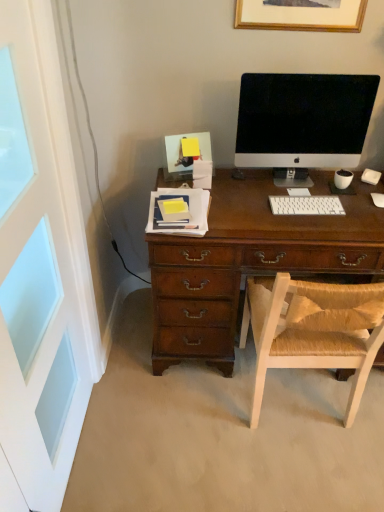
Identify the location of light brown woven chair at center. Image resolution: width=384 pixels, height=512 pixels. (313, 331).

Where is `satin black monitor at center`? The image size is (384, 512). satin black monitor at center is located at coordinates (303, 122).

In order to face white painted wood screen door at left, should I rotate leftwards or rightwards?

You should look left and rotate roughly 19.902 degrees.

Measure the distance between wooden picture frame at upper center and camera.

wooden picture frame at upper center is 1.61 meters away from camera.

Find the location of a particular element. The image size is (384, 512). wooden picture frame at upper center is located at coordinates (300, 15).

Where is `light brown woven chair at center`? The height and width of the screenshot is (512, 384). light brown woven chair at center is located at coordinates (313, 331).

Is wooden picture frame at upper center facing towards satin black monitor at center?

No, wooden picture frame at upper center is not turned towards satin black monitor at center.

From the image's perspective, which one is positioned lower, wooden picture frame at upper center or satin black monitor at center?

satin black monitor at center appears lower in the image.

From a real-world perspective, which object stands above the other?

wooden picture frame at upper center.

Does point (274, 304) appear closer or farther from the camera than point (373, 93)?

Point (274, 304) is closer to the camera than point (373, 93).

Is light brown woven chair at center not close to satin black monitor at center?

No, light brown woven chair at center is not far away from satin black monitor at center.

Is light brown woven chair at center positioned with its back to satin black monitor at center?

No, light brown woven chair at center is not facing the opposite direction of satin black monitor at center.

Based on the photo, can you confirm if light brown woven chair at center is positioned to the left of satin black monitor at center?

In fact, light brown woven chair at center is to the right of satin black monitor at center.

Would you say light brown woven chair at center is outside white painted wood screen door at left?

Yes, light brown woven chair at center is located beyond the bounds of white painted wood screen door at left.

From a real-world perspective, which is physically above, light brown woven chair at center or white painted wood screen door at left?

In real-world perspective, white painted wood screen door at left is above.

Which is behind, point (346, 342) or point (82, 264)?

The point (82, 264) is behind.

Between point (35, 33) and point (300, 330), which one is positioned behind?

The point (300, 330) is behind.

From a real-world perspective, which is physically above, white painted wood screen door at left or light brown woven chair at center?

In real-world perspective, white painted wood screen door at left is above.

This screenshot has height=512, width=384. In the image, there is a light brown woven chair at center. Find the location of `screen door above it (from the image's perspective)`. screen door above it (from the image's perspective) is located at coordinates (40, 268).

Can you confirm if white plastic keyboard at center is wider than light brown woven chair at center?

No.

In the scene shown: Would you say white plastic keyboard at center is a long distance from light brown woven chair at center?

No, white plastic keyboard at center is in close proximity to light brown woven chair at center.

How different are the orientations of white plastic keyboard at center and light brown woven chair at center in degrees?

The angle between the facing direction of white plastic keyboard at center and the facing direction of light brown woven chair at center is 180 degrees.

Considering the positions of points (314, 209) and (305, 310), is point (314, 209) farther from camera compared to point (305, 310)?

That is True.

From the image's perspective, who appears lower, satin black monitor at center or white painted wood screen door at left?

white painted wood screen door at left is shown below in the image.

From a real-world perspective, relative to white painted wood screen door at left, is satin black monitor at center vertically above or below?

In terms of real-world spatial position, satin black monitor at center is above white painted wood screen door at left.

Can you confirm if satin black monitor at center is smaller than white painted wood screen door at left?

Correct, satin black monitor at center occupies less space than white painted wood screen door at left.

From the image's perspective, who appears lower, white plastic keyboard at center or wooden picture frame at upper center?

white plastic keyboard at center.

Which of these two, white plastic keyboard at center or wooden picture frame at upper center, stands taller?

With more height is wooden picture frame at upper center.

Which object is further away from the camera taking this photo, white plastic keyboard at center or wooden picture frame at upper center?

white plastic keyboard at center is more distant.

At what (x,y) coordinates should I click in order to perform the action: click on picture frame located above the white plastic keyboard at center (from the image's perspective). Please return your answer as a coordinate pair (x, y). Image resolution: width=384 pixels, height=512 pixels. Looking at the image, I should click on (300, 15).

Identify the location of picture frame on the left of satin black monitor at center. This screenshot has height=512, width=384. (300, 15).

Identify the location of chair that is in front of the satin black monitor at center. (313, 331).

Considering their positions, is light brown woven chair at center positioned closer to wooden picture frame at upper center than satin black monitor at center?

satin black monitor at center lies closer to wooden picture frame at upper center than the other object.

In the scene shown: Considering their positions, is white painted wood screen door at left positioned closer to wooden picture frame at upper center than satin black monitor at center?

Among the two, satin black monitor at center is located nearer to wooden picture frame at upper center.

From the image, which object appears to be farther from satin black monitor at center, light brown woven chair at center or white painted wood screen door at left?

white painted wood screen door at left lies further to satin black monitor at center than the other object.

Considering their positions, is light brown woven chair at center positioned further to satin black monitor at center than white plastic keyboard at center?

light brown woven chair at center is positioned further to the anchor satin black monitor at center.

From the picture: From the image, which object appears to be nearer to satin black monitor at center, white plastic keyboard at center or wooden picture frame at upper center?

white plastic keyboard at center.

Consider the image. Which object lies further to the anchor point satin black monitor at center, white painted wood screen door at left or wooden picture frame at upper center?

Among the two, white painted wood screen door at left is located further to satin black monitor at center.

Considering their positions, is white plastic keyboard at center positioned closer to light brown woven chair at center than satin black monitor at center?

The object closer to light brown woven chair at center is white plastic keyboard at center.

Based on their spatial positions, is white plastic keyboard at center or satin black monitor at center closer to white painted wood screen door at left?

white plastic keyboard at center is closer to white painted wood screen door at left.

What are the coordinates of `computer monitor between wooden picture frame at upper center and light brown woven chair at center in the up-down direction` in the screenshot? It's located at (303, 122).

The width and height of the screenshot is (384, 512). What are the coordinates of `picture frame between white painted wood screen door at left and white plastic keyboard at center along the z-axis` in the screenshot? It's located at (300, 15).

Find the location of a particular element. chair between white painted wood screen door at left and white plastic keyboard at center in the front-back direction is located at coordinates (313, 331).

At what (x,y) coordinates should I click in order to perform the action: click on computer monitor between white painted wood screen door at left and white plastic keyboard at center from front to back. Please return your answer as a coordinate pair (x, y). Image resolution: width=384 pixels, height=512 pixels. Looking at the image, I should click on (303, 122).